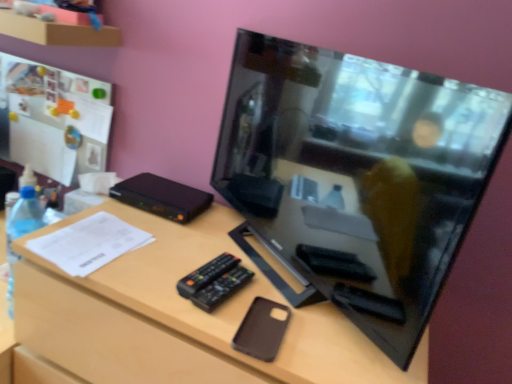
At what (x,y) coordinates should I click in order to perform the action: click on free spot below black glossy television at center (from a real-world perspective). Please return your answer as a coordinate pair (x, y). The image size is (512, 384). Looking at the image, I should click on (288, 279).